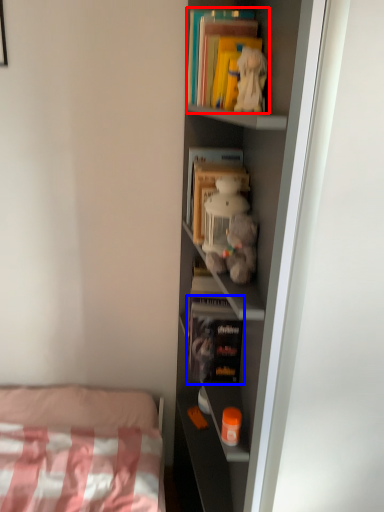
Question: Which object appears farthest to the camera in this image, book (highlighted by a red box) or book (highlighted by a blue box)?

Choices:
 (A) book
 (B) book

Answer: (B)